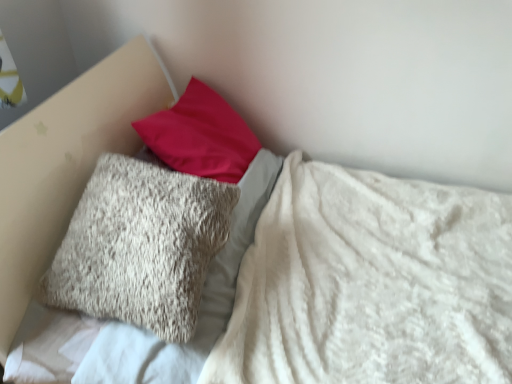
The width and height of the screenshot is (512, 384). What do you see at coordinates (141, 245) in the screenshot? I see `fuzzy beige pillow at upper left` at bounding box center [141, 245].

Locate an element on the screen. The image size is (512, 384). fuzzy beige pillow at upper left is located at coordinates (141, 245).

At what (x,y) coordinates should I click in order to perform the action: click on fuzzy beige pillow at upper left. Please return your answer as a coordinate pair (x, y). Looking at the image, I should click on (141, 245).